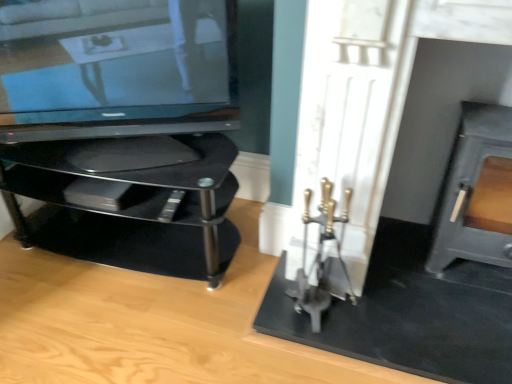
What are the coordinates of `free spot below satin black tv at left (from a real-world perspective)` in the screenshot? It's located at (119, 160).